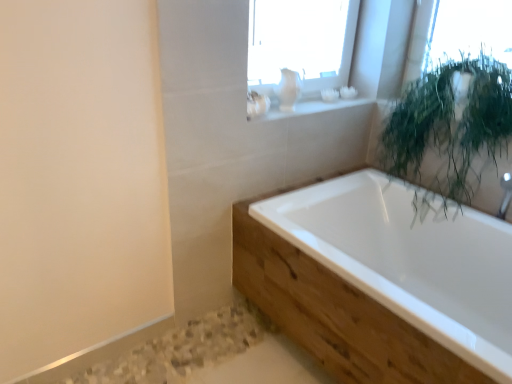
Question: Considering the positions of point tap(433, 182) and point tap(279, 110), is point tap(433, 182) closer or farther from the camera than point tap(279, 110)?

Choices:
 (A) farther
 (B) closer

Answer: (A)

Question: Is green leafy plant at upper right spatially inside white ceramic vase at upper center, or outside of it?

Choices:
 (A) inside
 (B) outside

Answer: (B)

Question: Which object is positioned closest to the white glossy bathtub at center?

Choices:
 (A) white ceramic vase at upper center
 (B) green leafy plant at upper right

Answer: (B)

Question: Which object is the closest to the white glossy bathtub at center?

Choices:
 (A) green leafy plant at upper right
 (B) white ceramic vase at upper center

Answer: (A)